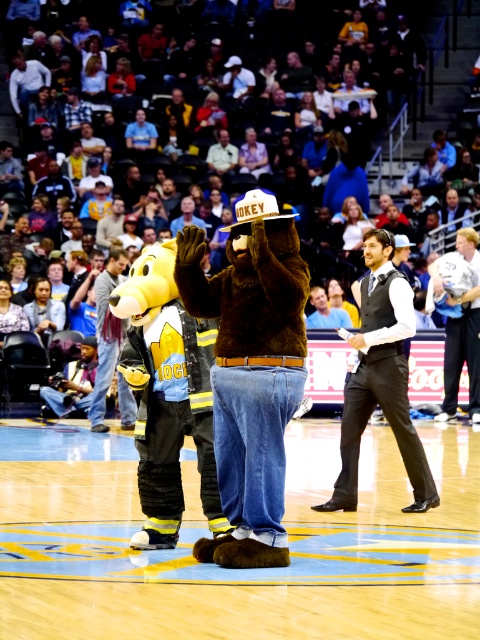
Can you confirm if wooden polished floor at center is positioned above black satin vest at center?

No.

Who is positioned more to the left, wooden polished floor at center or black satin vest at center?

Positioned to the left is wooden polished floor at center.

Between point (292, 564) and point (439, 500), which one is positioned in front?

Positioned in front is point (292, 564).

Locate an element on the screen. wooden polished floor at center is located at coordinates pos(235,570).

Who is positioned more to the left, brown fuzzy bear at center or denim jeans at center?

denim jeans at center is more to the left.

Does point (243, 196) come in front of point (126, 417)?

No, it is not.

At what (x,y) coordinates should I click in order to perform the action: click on brown fuzzy bear at center. Please return your answer as a coordinate pair (x, y). Looking at the image, I should click on (251, 371).

How much distance is there between multicolored fabric seats at center and brown fuzzy bear at center?

A distance of 42.80 feet exists between multicolored fabric seats at center and brown fuzzy bear at center.

Which is behind, point (324, 80) or point (257, 234)?

Point (324, 80)

Is point (99, 33) behind point (225, 410)?

That is True.

This screenshot has height=640, width=480. I want to click on multicolored fabric seats at center, so click(241, 93).